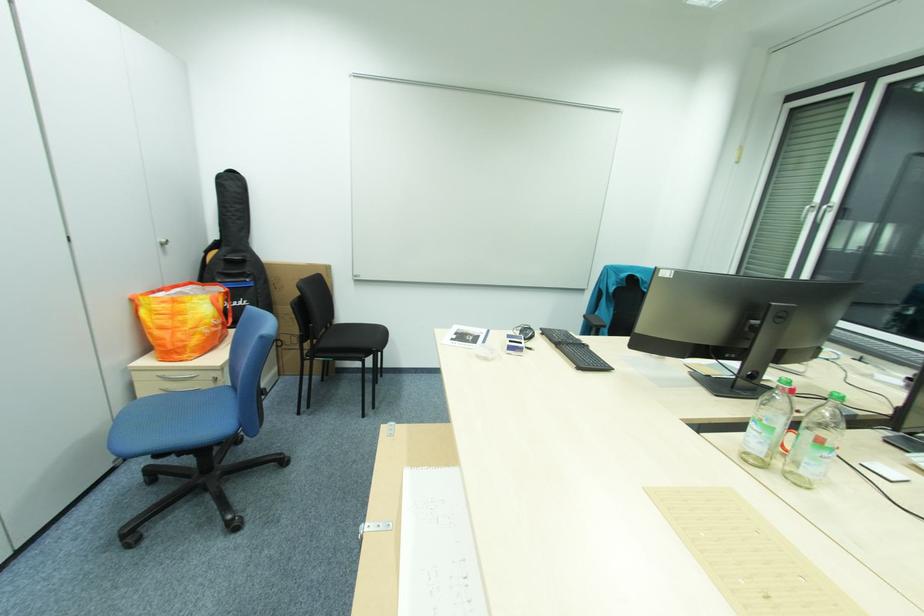
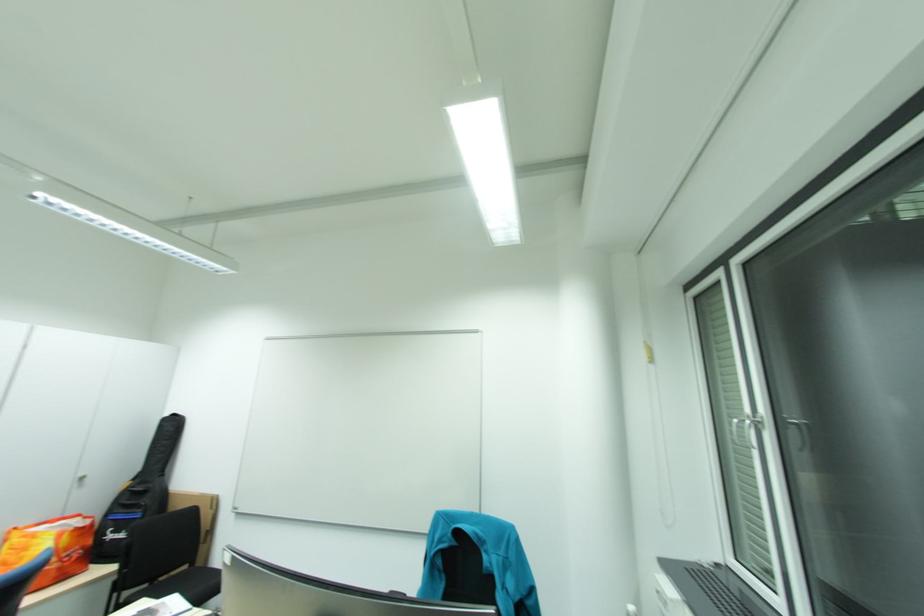
Find the pixel in the second image that matches [256,277] in the first image.

(149, 508)